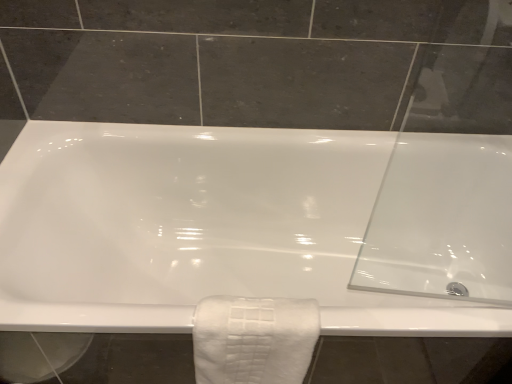
Question: Is white textured towel at lower center shorter than white glossy bathtub at center?

Choices:
 (A) yes
 (B) no

Answer: (A)

Question: From a real-world perspective, is white textured towel at lower center located beneath white glossy bathtub at center?

Choices:
 (A) no
 (B) yes

Answer: (A)

Question: Is white textured towel at lower center wider than white glossy bathtub at center?

Choices:
 (A) no
 (B) yes

Answer: (A)

Question: Is white textured towel at lower center positioned beyond the bounds of white glossy bathtub at center?

Choices:
 (A) no
 (B) yes

Answer: (A)

Question: Can white glossy bathtub at center be found inside white textured towel at lower center?

Choices:
 (A) no
 (B) yes

Answer: (A)

Question: From a real-world perspective, is white textured towel at lower center located higher than white glossy bathtub at center?

Choices:
 (A) no
 (B) yes

Answer: (B)

Question: Considering the relative positions of white glossy bathtub at center and white textured towel at lower center in the image provided, is white glossy bathtub at center to the left of white textured towel at lower center from the viewer's perspective?

Choices:
 (A) no
 (B) yes

Answer: (A)

Question: Is white glossy bathtub at center aimed at white textured towel at lower center?

Choices:
 (A) no
 (B) yes

Answer: (B)

Question: Would you say white glossy bathtub at center contains white textured towel at lower center?

Choices:
 (A) no
 (B) yes

Answer: (B)

Question: Is white glossy bathtub at center further to camera compared to white textured towel at lower center?

Choices:
 (A) no
 (B) yes

Answer: (B)

Question: From the image's perspective, would you say white glossy bathtub at center is shown under white textured towel at lower center?

Choices:
 (A) yes
 (B) no

Answer: (B)

Question: Is white glossy bathtub at center oriented away from white textured towel at lower center?

Choices:
 (A) no
 (B) yes

Answer: (B)

Question: From the image's perspective, relative to white glossy bathtub at center, is white textured towel at lower center above or below?

Choices:
 (A) below
 (B) above

Answer: (A)